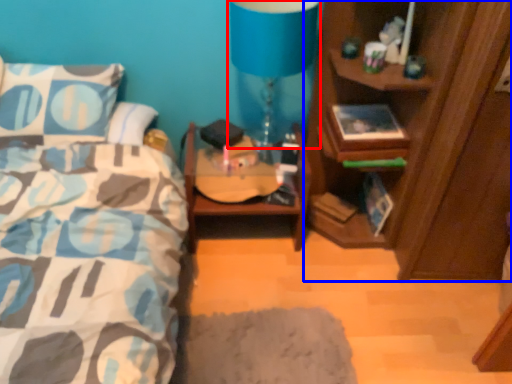
Question: Which object is further to the camera taking this photo, table lamp (highlighted by a red box) or cabinetry (highlighted by a blue box)?

Choices:
 (A) table lamp
 (B) cabinetry

Answer: (A)